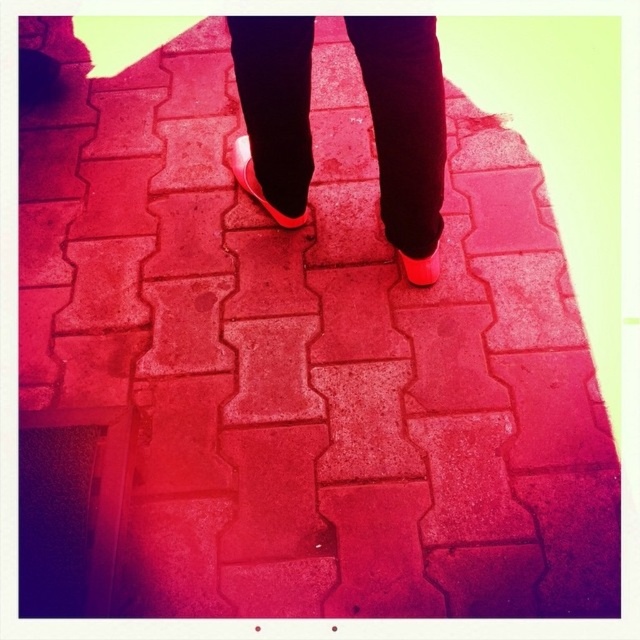
Between shiny patent leather shoe at center and matte rubber shoe at center, which one has more height?

With more height is shiny patent leather shoe at center.

Can you confirm if shiny patent leather shoe at center is positioned to the right of matte rubber shoe at center?

In fact, shiny patent leather shoe at center is to the left of matte rubber shoe at center.

Which is behind, point (252, 161) or point (401, 250)?

Positioned behind is point (252, 161).

Find the location of `shiny patent leather shoe at center`. shiny patent leather shoe at center is located at coordinates (257, 182).

Can you confirm if matte pink shoes at center is positioned above matte rubber shoe at center?

Yes, matte pink shoes at center is above matte rubber shoe at center.

Measure the distance between point (272,99) and camera.

The distance of point (272,99) from camera is 1.28 meters.

What do you see at coordinates (404, 124) in the screenshot? I see `matte pink shoes at center` at bounding box center [404, 124].

Identify the location of matte pink shoes at center. This screenshot has height=640, width=640. (404, 124).

Which of these two, matte pink shoes at center or shiny patent leather shoe at center, stands taller?

With more height is matte pink shoes at center.

You are a GUI agent. You are given a task and a screenshot of the screen. Output one action in this format:
    pyautogui.click(x=<x>, y=<y>)
    Task: Click on the matte pink shoes at center
    
    Given the screenshot: What is the action you would take?
    pyautogui.click(x=404, y=124)